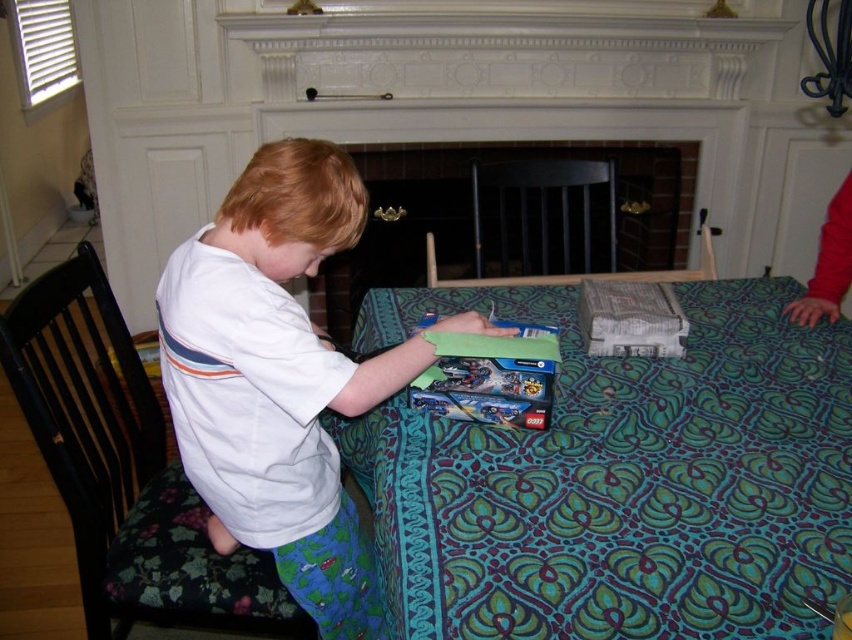
Question: Which point is farther to the camera?

Choices:
 (A) white cotton shirt at center
 (B) green patterned fabric at center
 (C) brick fireplace at center

Answer: (C)

Question: Can you confirm if white cotton shirt at center is positioned to the right of brick fireplace at center?

Choices:
 (A) no
 (B) yes

Answer: (A)

Question: Which point is farther from the camera taking this photo?

Choices:
 (A) (781, 492)
 (B) (717, 188)

Answer: (B)

Question: Is green patterned fabric at center below white cotton shirt at center?

Choices:
 (A) no
 (B) yes

Answer: (B)

Question: Among these points, which one is nearest to the camera?

Choices:
 (A) (505, 106)
 (B) (514, 522)

Answer: (B)

Question: Is green patterned fabric at center to the left of brick fireplace at center from the viewer's perspective?

Choices:
 (A) no
 (B) yes

Answer: (B)